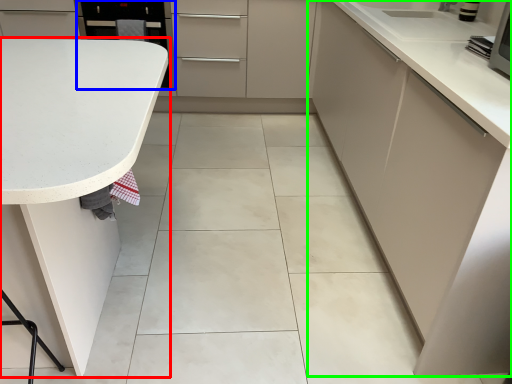
Question: Which object is positioned closest to countertop (highlighted by a red box)? Select from appliance (highlighted by a blue box) and cabinetry (highlighted by a green box).

Choices:
 (A) appliance
 (B) cabinetry

Answer: (B)